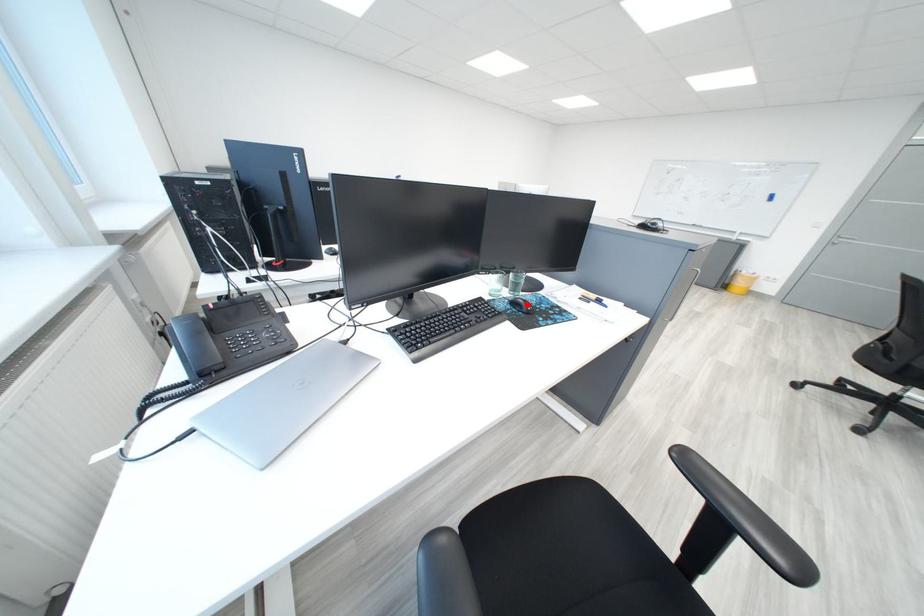
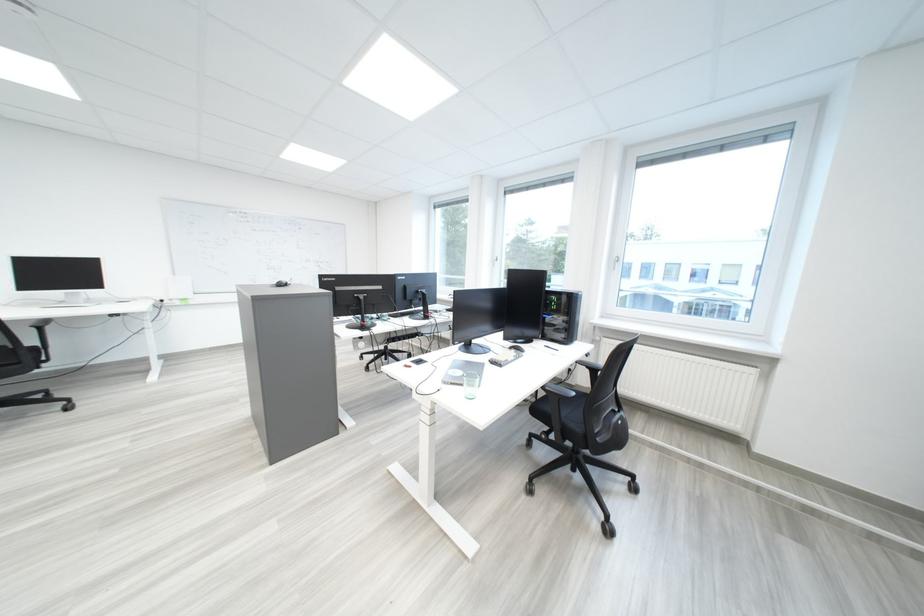
Question: I am providing you with two images of the same scene from different viewpoints. A red point is marked on the first image. Is the red point's position out of view in image 2?

Choices:
 (A) Yes
 (B) No

Answer: (A)